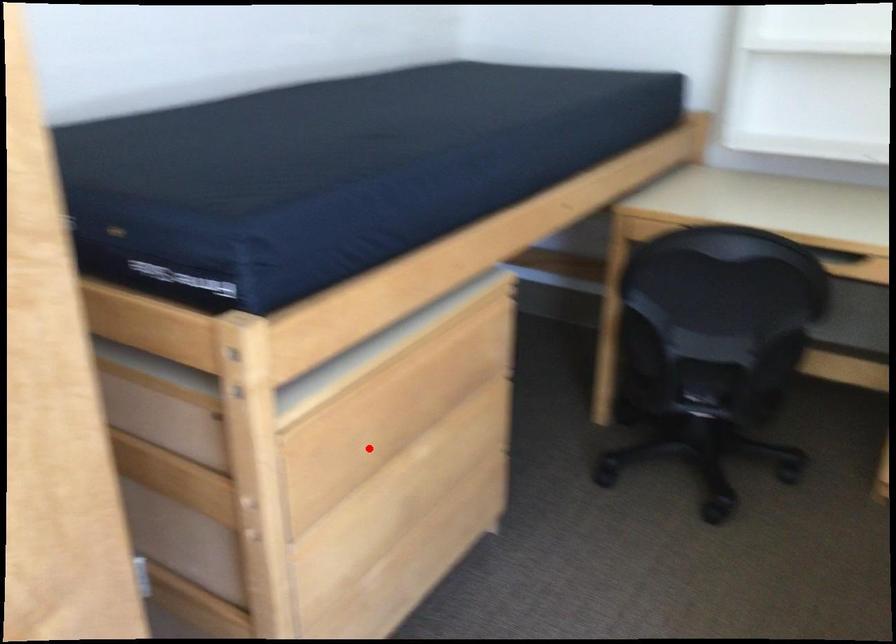
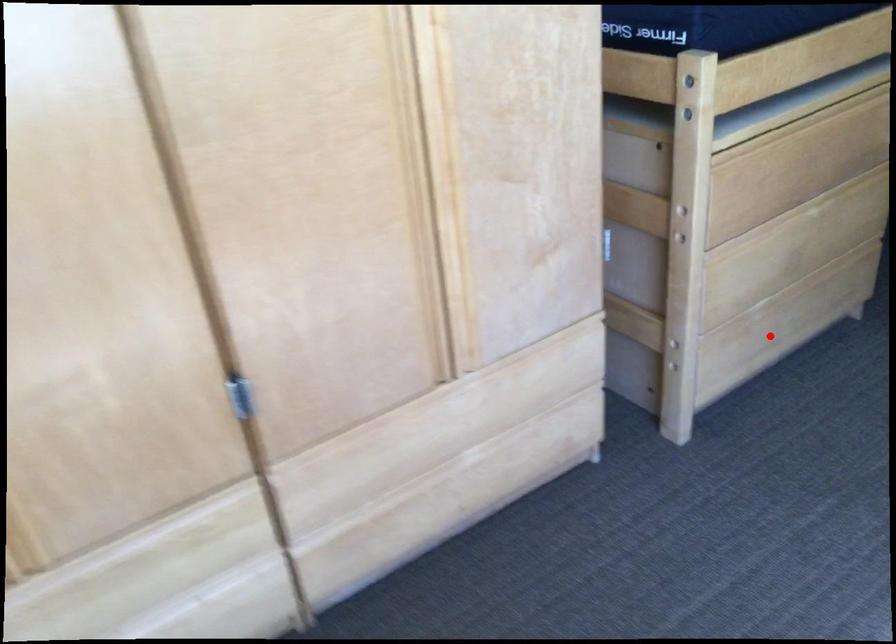
I am providing you with two images of the same scene from different viewpoints. A red point is marked on the first image and another point is marked on the second image. Are the points marked in image1 and image2 representing the same 3D position?

No